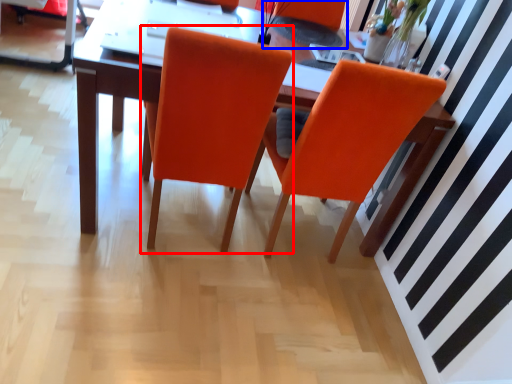
Question: Among these objects, which one is farthest to the camera, chair (highlighted by a red box) or armchair (highlighted by a blue box)?

Choices:
 (A) chair
 (B) armchair

Answer: (B)